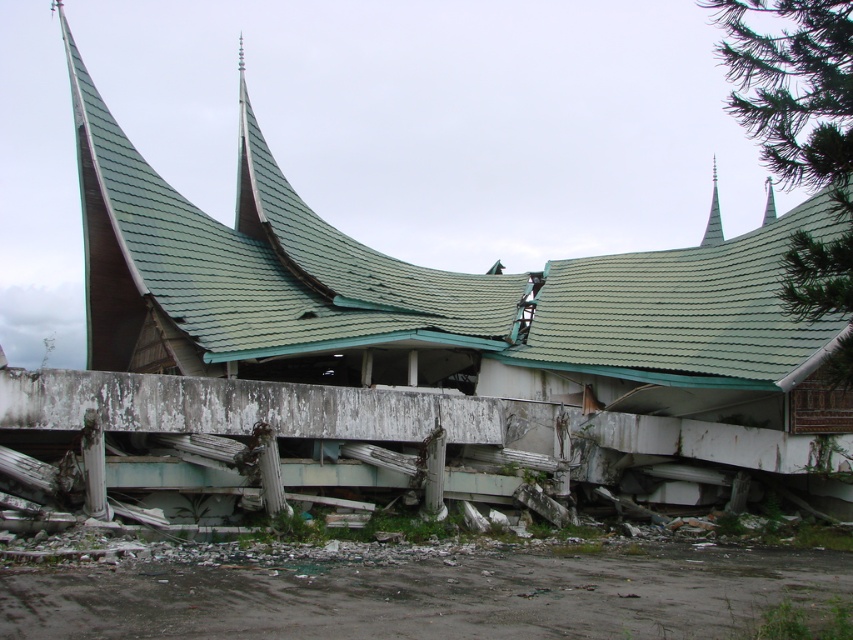
Is green tile spire at upper center below green shingled spire at upper center?

Yes.

The width and height of the screenshot is (853, 640). Identify the location of green tile spire at upper center. (712, 216).